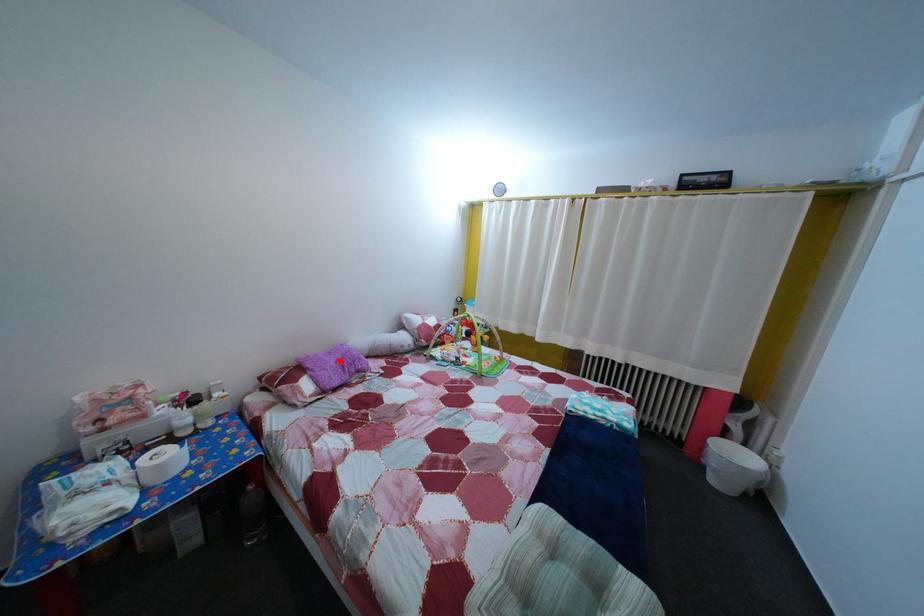
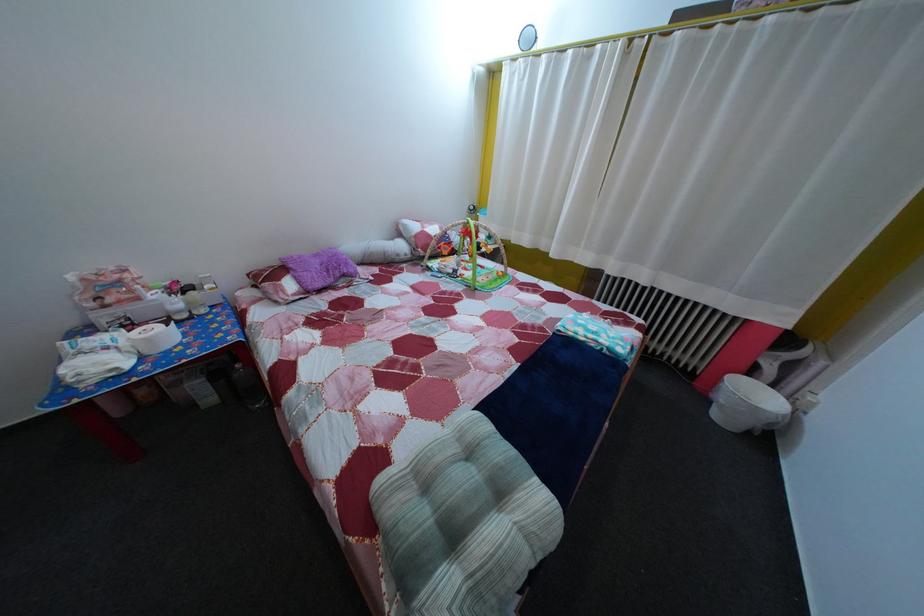
In the second image, find the point that corresponds to the highlighted location in the first image.

(325, 262)